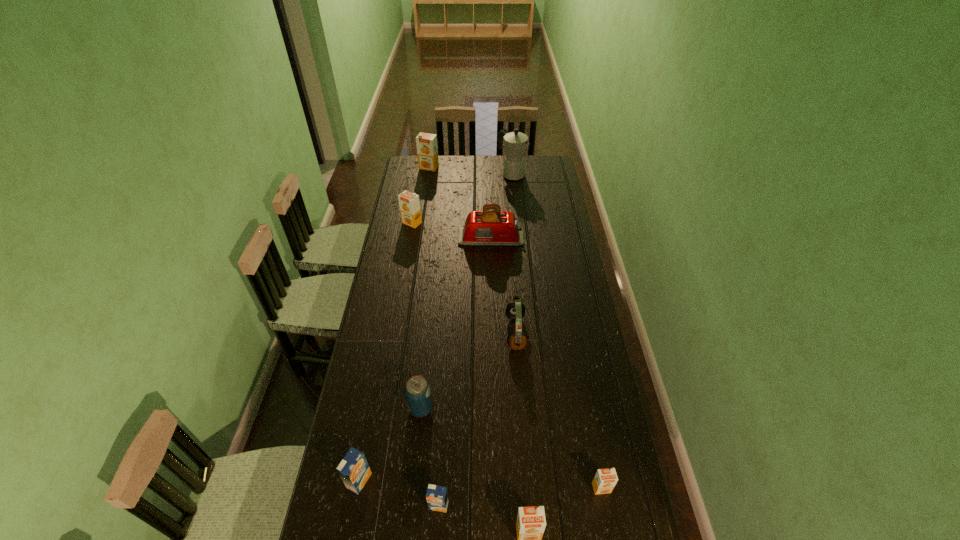
The width and height of the screenshot is (960, 540). In order to click on free space that satisfies the following two spatial constraints: 1. on the ear cups of the headset; 2. on the front side of the nearer blue orange_juice in this screenshot , I will do tap(528, 505).

Where is `vacant position in the image that satisfies the following two spatial constraints: 1. on the back side of the farther blue orange_juice; 2. on the right side of the gray coffeepot`? This screenshot has height=540, width=960. vacant position in the image that satisfies the following two spatial constraints: 1. on the back side of the farther blue orange_juice; 2. on the right side of the gray coffeepot is located at coordinates point(417,174).